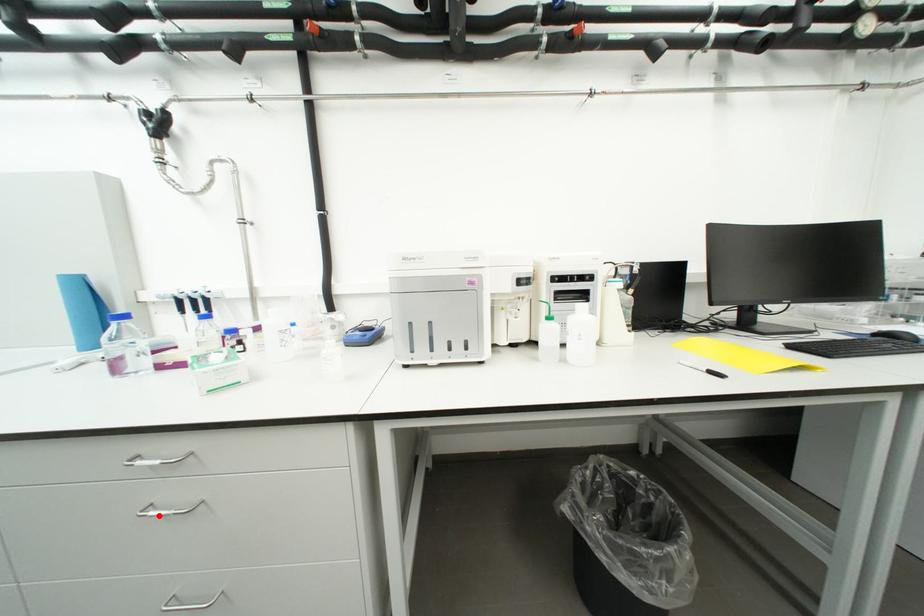
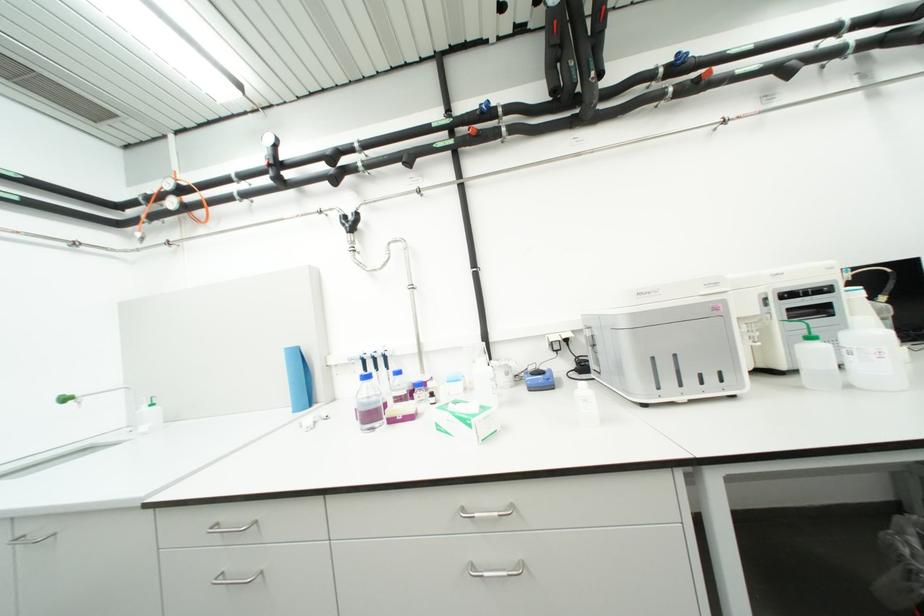
In the second image, find the point that corresponds to the highlighted location in the first image.

(493, 575)